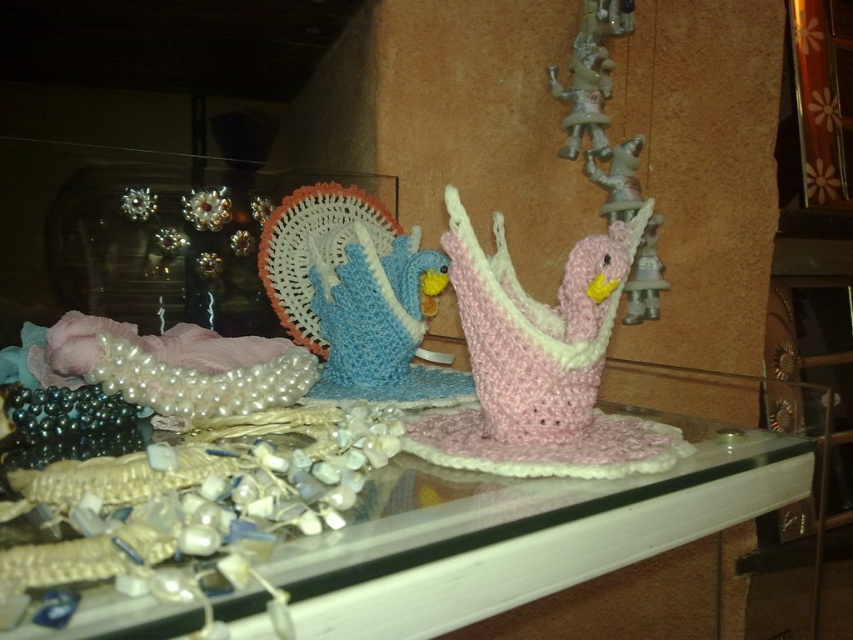
You are standing in front of the display and want to place a small box on the translucent glass table at center. Based on the coordinates provided, can you confirm if the table is positioned in the center of the display?

The translucent glass table at center is located at coordinates point (x=543, y=516), which corresponds to the center position of the display.

You are arranging handmade crafts on a glass shelf. You have a translucent glass table at center and a pink yarn duck at center. Which object is positioned to the right of the other?

The translucent glass table at center is to the right of the pink yarn duck at center.